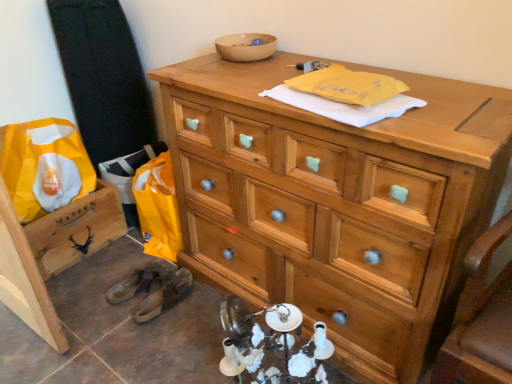
What are the coordinates of `free spot below brown leather shoe at lower left, the 2th shoe when ordered from left to right (from a real-world perspective)` in the screenshot? It's located at (161, 302).